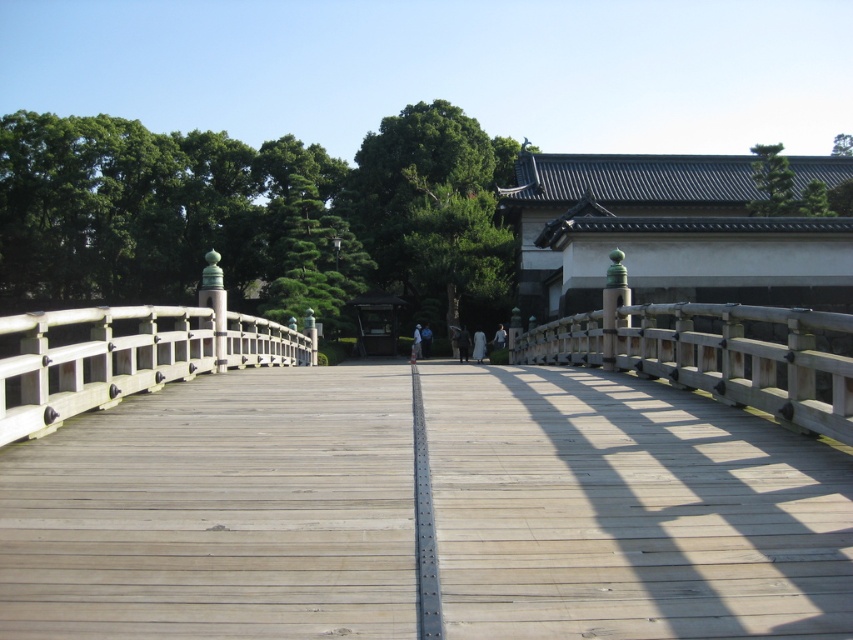
Can you confirm if wooden rail at center is positioned below white wood rail at left?

Yes.

Based on the photo, who is more forward, (637, 337) or (192, 314)?

Point (192, 314) is in front.

Where is `wooden rail at center`? wooden rail at center is located at coordinates (717, 355).

Which is below, light brown wood bridge at center or wooden rail at center?

Positioned lower is light brown wood bridge at center.

Is light brown wood bridge at center shorter than wooden rail at center?

Yes.

Identify the location of light brown wood bridge at center. This screenshot has width=853, height=640. (628, 509).

Who is more distant from viewer, [144,406] or [111,308]?

The point [111,308] is more distant.

Does light brown wood bridge at center appear on the right side of white wood rail at left?

Yes, light brown wood bridge at center is to the right of white wood rail at left.

Image resolution: width=853 pixels, height=640 pixels. What are the coordinates of `light brown wood bridge at center` in the screenshot? It's located at (628, 509).

Locate an element on the screen. light brown wood bridge at center is located at coordinates (628, 509).